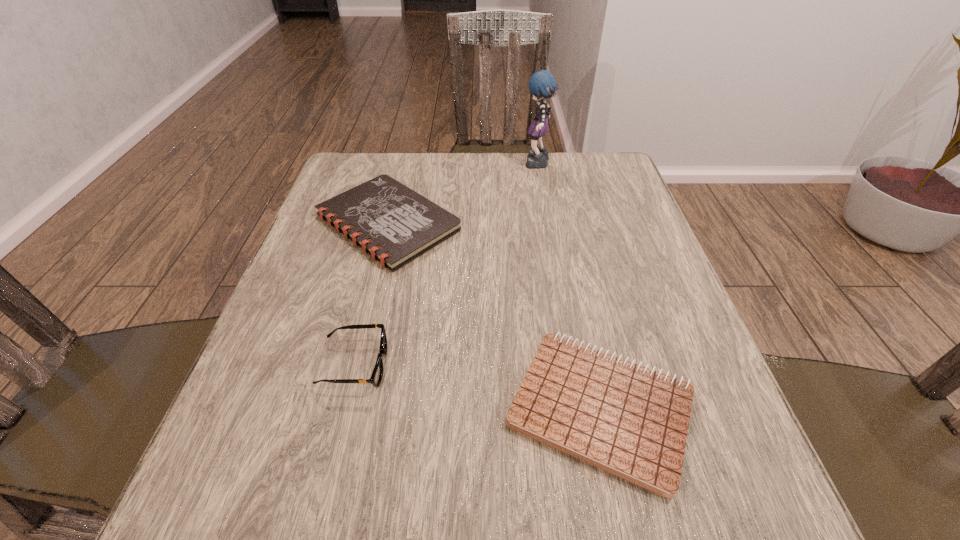
This screenshot has height=540, width=960. I want to click on vacant space located 0.350m on the front-facing side of the sunglasses, so click(591, 365).

The image size is (960, 540). I want to click on vacant space situated 0.140m on the front of the second farthest object, so click(362, 325).

Locate an element on the screen. Image resolution: width=960 pixels, height=540 pixels. free location located on the back of the nearer notebook is located at coordinates (564, 238).

This screenshot has width=960, height=540. What are the coordinates of `rag doll located in the far edge section of the desktop` in the screenshot? It's located at (542, 84).

Identify the location of notebook at the far edge. The width and height of the screenshot is (960, 540). (394, 224).

What are the coordinates of `object present at the near edge` in the screenshot? It's located at (631, 421).

This screenshot has height=540, width=960. What are the coordinates of `sunglasses situated at the left edge` in the screenshot? It's located at (377, 374).

You are a GUI agent. You are given a task and a screenshot of the screen. Output one action in this format:
    pyautogui.click(x=<x>, y=<y>)
    Task: Click on the notebook that is at the left edge
    Image resolution: width=960 pixels, height=540 pixels.
    Given the screenshot: What is the action you would take?
    pyautogui.click(x=394, y=224)

The height and width of the screenshot is (540, 960). In order to click on object that is positioned at the right edge in this screenshot , I will do `click(631, 421)`.

Identify the location of object that is at the far left corner. Image resolution: width=960 pixels, height=540 pixels. (394, 224).